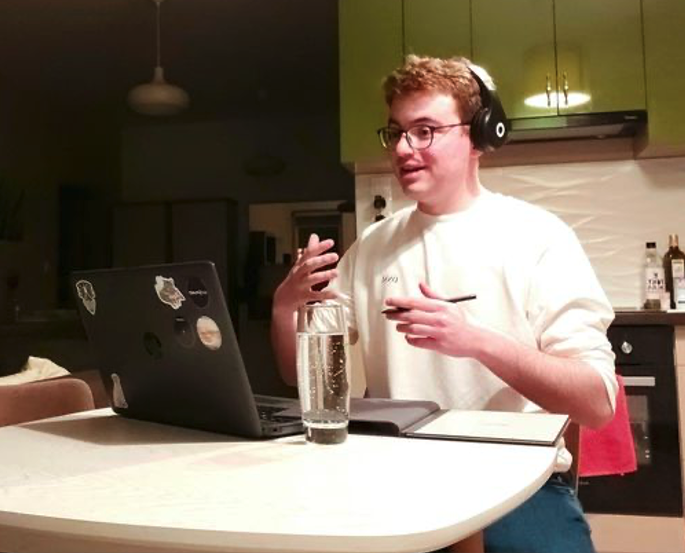
I want to click on book, so click(468, 436).